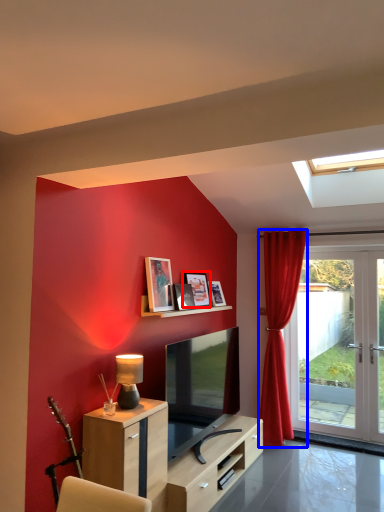
Question: Which of the following is the farthest to the observer, picture frame (highlighted by a red box) or curtain (highlighted by a blue box)?

Choices:
 (A) picture frame
 (B) curtain

Answer: (B)